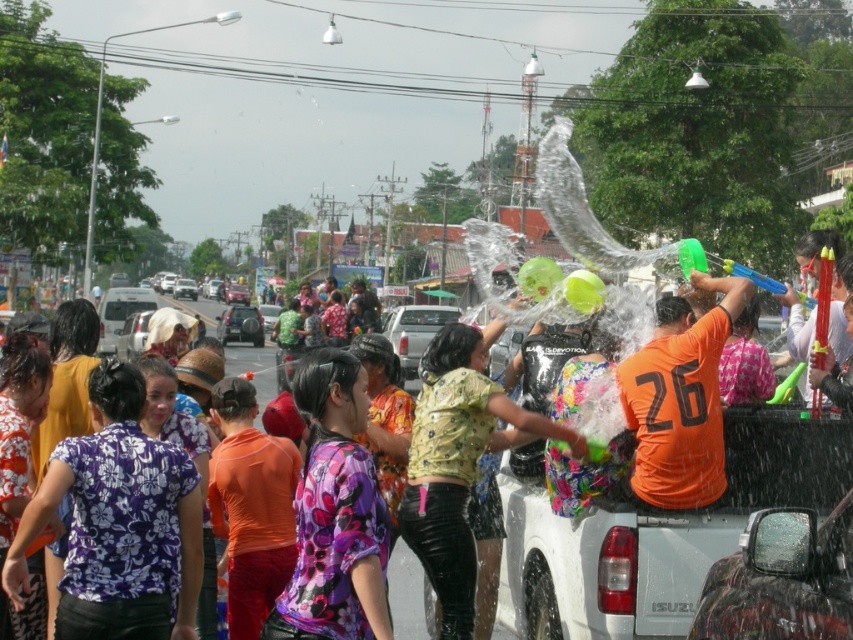
Question: Which point is farther to the camera?

Choices:
 (A) floral fabric blouse at center
 (B) matte black car at center
 (C) orange matte shirt at center

Answer: (B)

Question: Does matte black car at center have a larger size compared to silver metallic car at center?

Choices:
 (A) no
 (B) yes

Answer: (A)

Question: Can you confirm if matte black car at center is positioned to the right of white matte van at center?

Choices:
 (A) yes
 (B) no

Answer: (B)

Question: Is floral fabric blouse at center behind white matte truck at center?

Choices:
 (A) yes
 (B) no

Answer: (B)

Question: Which point is closer to the camera?

Choices:
 (A) (122, 337)
 (B) (180, 294)
 (C) (248, 321)

Answer: (A)

Question: Based on their relative distances, which object is farther from the orange matte shirt at center?

Choices:
 (A) white matte van at center
 (B) clear plastic mirror at lower right

Answer: (A)